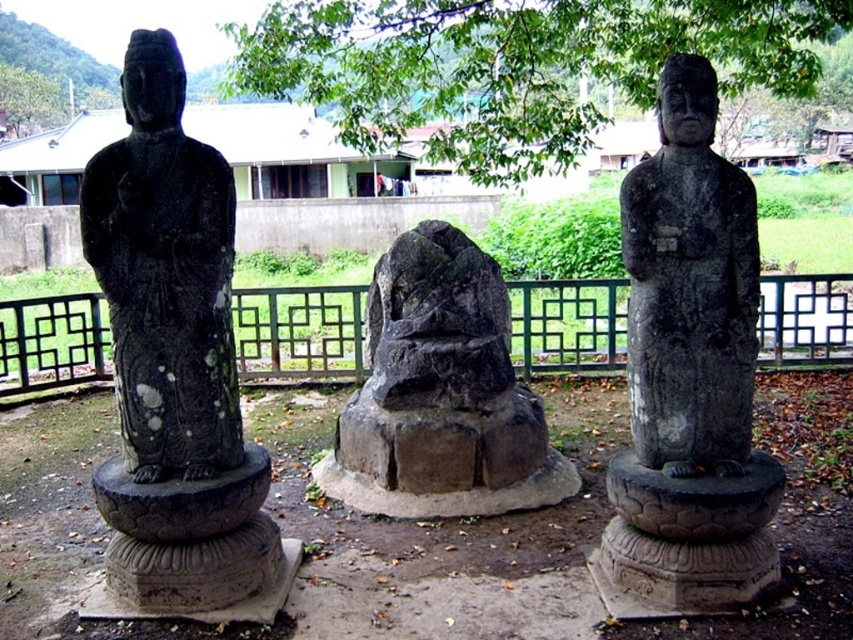
Based on the scene description, which object is taller between the black stone statue at center and the black metal fence at center?

The black stone statue at center is taller than the black metal fence at center.

You are standing in front of the three statues and want to touch the middle statue. Which point should you reach for, point at coordinates point (140, 278) or point (258, 88)?

You should reach for point at coordinates point (140, 278) because it is in front of point (258, 88), making it closer to you.